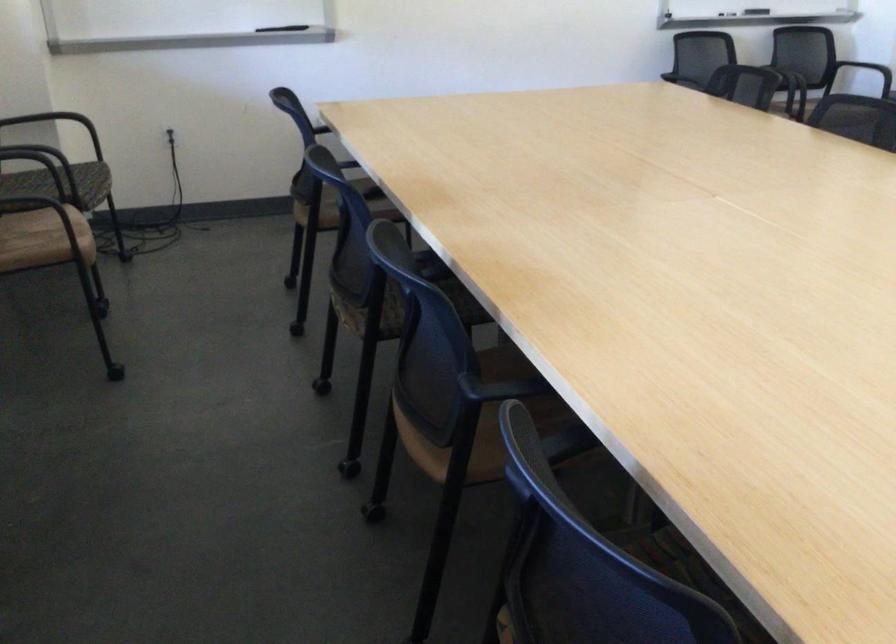
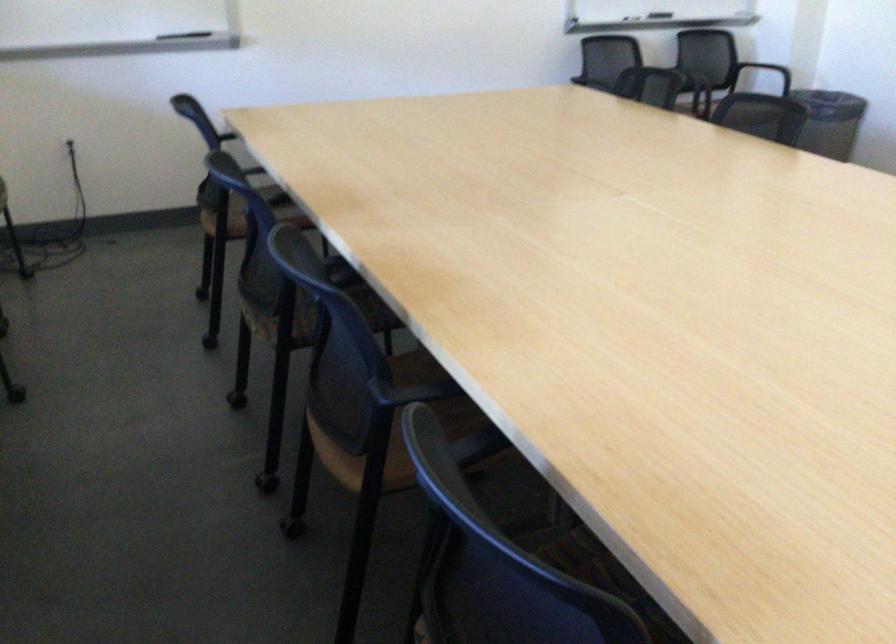
Locate, in the second image, the point that corresponds to (564,453) in the first image.

(475, 451)